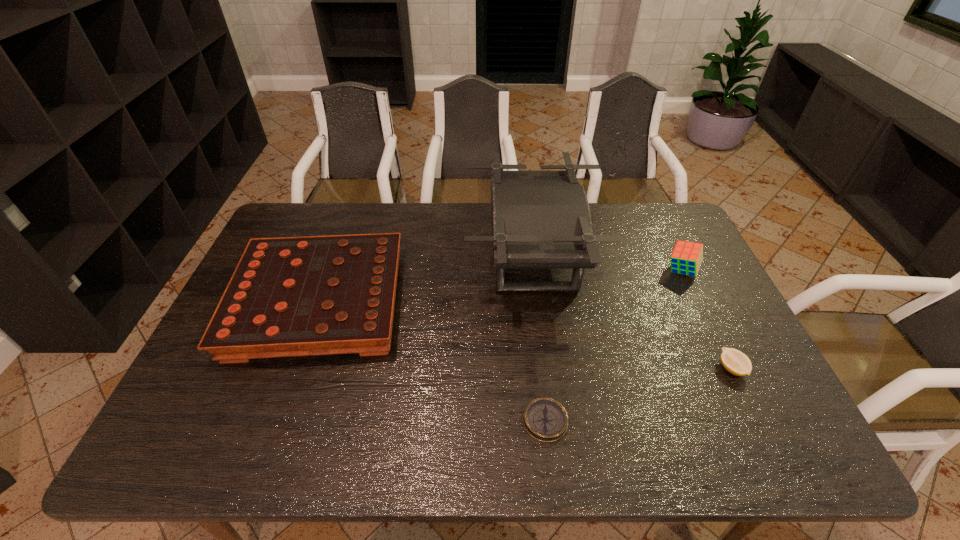
In order to click on vacant space at the near edge of the desktop in this screenshot , I will do `click(704, 437)`.

This screenshot has width=960, height=540. In the image, there is a desktop. Find the location of `vacant space at the left edge`. vacant space at the left edge is located at coordinates tap(191, 416).

I want to click on vacant space at the right edge of the desktop, so click(x=732, y=340).

Locate an element on the screen. vacant point at the far left corner is located at coordinates (284, 224).

In the image, there is a desktop. What are the coordinates of `vacant space at the far right corner` in the screenshot? It's located at (660, 240).

This screenshot has width=960, height=540. In the image, there is a desktop. In order to click on vacant region at the near right corner in this screenshot , I will do `click(778, 435)`.

Locate an element on the screen. Image resolution: width=960 pixels, height=540 pixels. free spot between the cube and the nearest object is located at coordinates (613, 346).

You are a GUI agent. You are given a task and a screenshot of the screen. Output one action in this format:
    pyautogui.click(x=<x>, y=<y>)
    Task: Click on the empty location between the third tallest object and the tallest object
    
    Given the screenshot: What is the action you would take?
    pyautogui.click(x=426, y=281)

This screenshot has width=960, height=540. In order to click on vacant area that lies between the fourth tallest object and the gameboard in this screenshot , I will do `click(525, 336)`.

Where is `empty location between the gameboard and the lemon`? The height and width of the screenshot is (540, 960). empty location between the gameboard and the lemon is located at coordinates (525, 336).